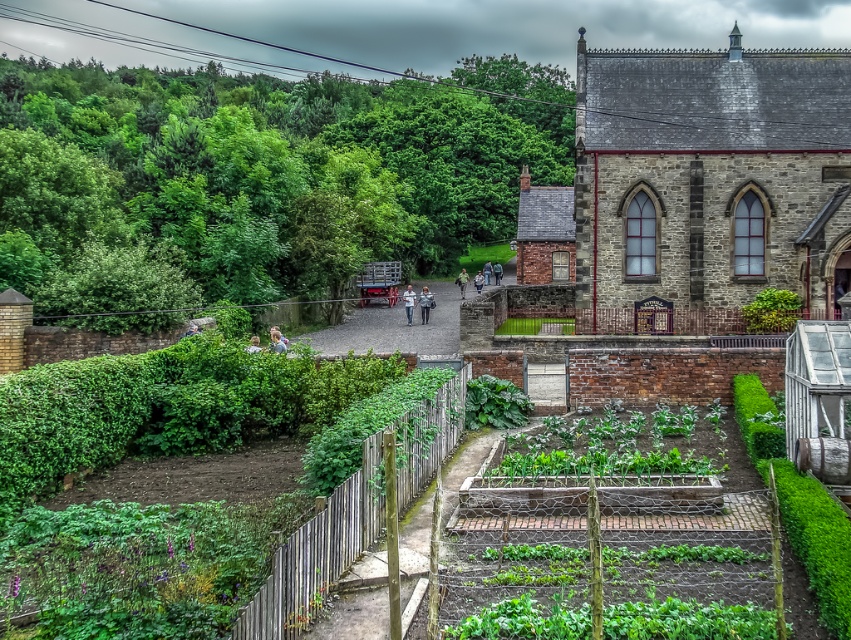
Question: Which point is closer to the camera?

Choices:
 (A) green leafy hedge at upper left
 (B) gray stone church at upper right
 (C) green wooden fence at lower center

Answer: (C)

Question: Does green leafy hedge at upper left appear under green wooden fence at lower center?

Choices:
 (A) yes
 (B) no

Answer: (B)

Question: Is green leafy hedge at upper left below green wooden fence at lower center?

Choices:
 (A) no
 (B) yes

Answer: (A)

Question: Is green leafy hedge at upper left positioned before green wooden fence at lower center?

Choices:
 (A) yes
 (B) no

Answer: (B)

Question: Which point appears closest to the camera in this image?

Choices:
 (A) (524, 467)
 (B) (672, 266)

Answer: (A)

Question: Which point is closer to the camera?

Choices:
 (A) green wooden fence at lower center
 (B) green leafy hedge at upper left

Answer: (A)